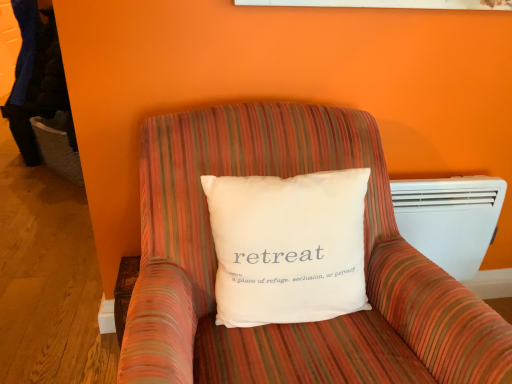
Question: Is white plastic heater at right wider than white cotton pillow at center?

Choices:
 (A) yes
 (B) no

Answer: (B)

Question: Does white plastic heater at right have a larger size compared to white cotton pillow at center?

Choices:
 (A) no
 (B) yes

Answer: (A)

Question: From the image's perspective, is white plastic heater at right over white cotton pillow at center?

Choices:
 (A) yes
 (B) no

Answer: (B)

Question: Is white plastic heater at right looking in the opposite direction of white cotton pillow at center?

Choices:
 (A) no
 (B) yes

Answer: (A)

Question: Does white plastic heater at right appear on the right side of white cotton pillow at center?

Choices:
 (A) no
 (B) yes

Answer: (B)

Question: Is the depth of white plastic heater at right less than that of white cotton pillow at center?

Choices:
 (A) no
 (B) yes

Answer: (A)

Question: From the image's perspective, is white cotton pillow at center above white plastic heater at right?

Choices:
 (A) no
 (B) yes

Answer: (B)

Question: Is the depth of white cotton pillow at center greater than that of white plastic heater at right?

Choices:
 (A) no
 (B) yes

Answer: (A)

Question: Is white cotton pillow at center oriented towards white plastic heater at right?

Choices:
 (A) yes
 (B) no

Answer: (B)

Question: Considering the relative positions of white cotton pillow at center and white plastic heater at right in the image provided, is white cotton pillow at center to the left of white plastic heater at right from the viewer's perspective?

Choices:
 (A) yes
 (B) no

Answer: (A)

Question: Is white cotton pillow at center not within white plastic heater at right?

Choices:
 (A) yes
 (B) no

Answer: (A)

Question: Is white cotton pillow at center not near white plastic heater at right?

Choices:
 (A) yes
 (B) no

Answer: (B)

Question: Considering the relative sizes of white cotton pillow at center and striped fabric armchair at center in the image provided, is white cotton pillow at center thinner than striped fabric armchair at center?

Choices:
 (A) yes
 (B) no

Answer: (A)